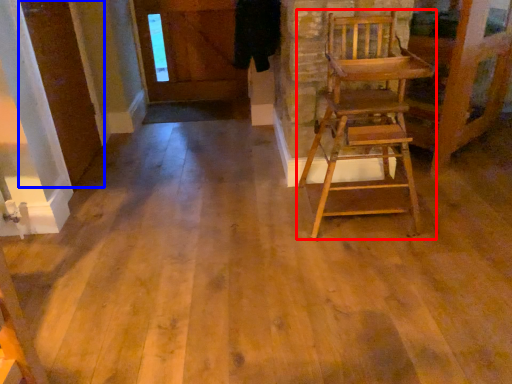
Question: Which point is further to the camera, chair (highlighted by a red box) or door (highlighted by a blue box)?

Choices:
 (A) chair
 (B) door

Answer: (B)